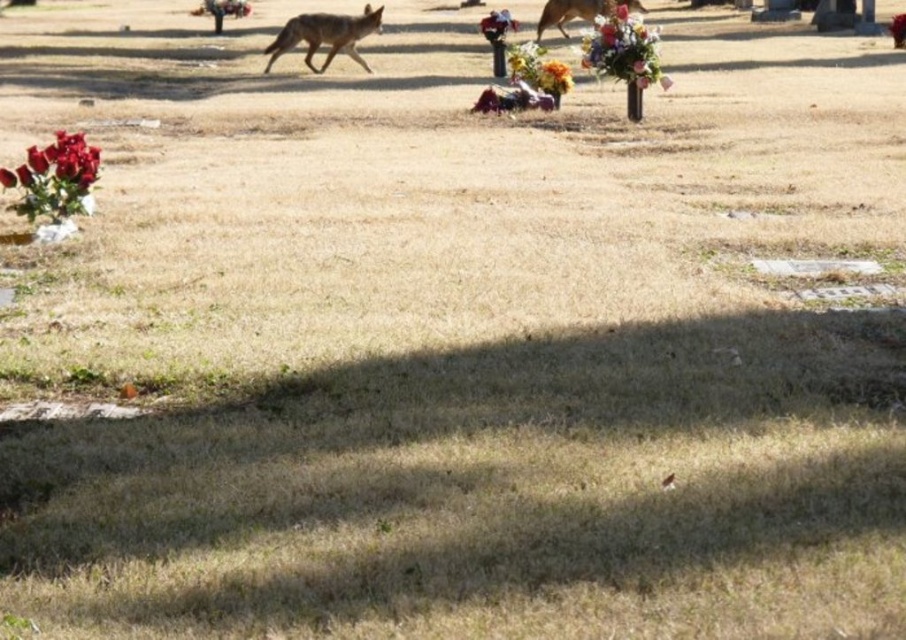
You are standing at the point marked as point (623, 49) in the image. What do you see there?

At point (623, 49) lies a floral bouquet at upper center.

You are standing at the origin point of the coordinate system. You see the brown fur coyote at upper center. What are its coordinates?

The coordinates of the brown fur coyote at upper center are at point (325, 35).

You are standing at the point marked as point (325,35) in the cemetery scene. What do you see around you?

You are standing at the point marked as point (325,35), which corresponds to the brown fur coyote at upper center. Around you, there are sparse dry grass, several flower arrangements with red roses and mixed yellow and orange flowers in small cylindrical containers, and in the background, a coyote walking across the grassy field.